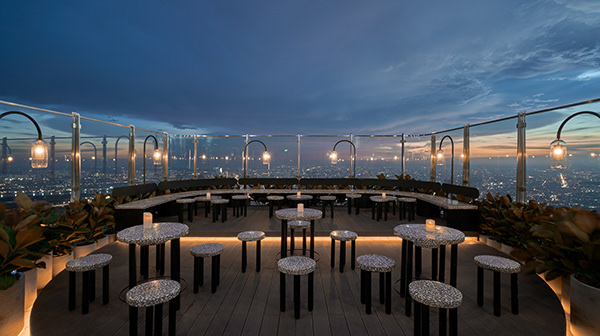
Where is `candles`? candles is located at coordinates (148, 217), (301, 207), (435, 224).